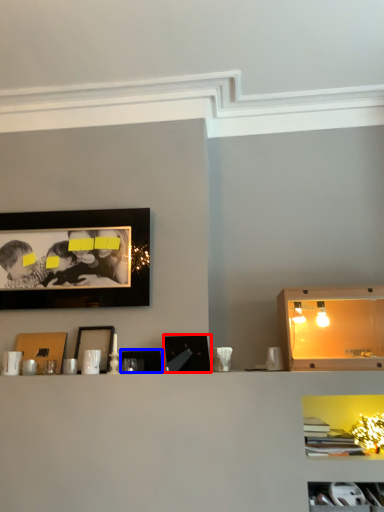
Question: Which object is closer to the camera taking this photo, picture frame (highlighted by a red box) or picture frame (highlighted by a blue box)?

Choices:
 (A) picture frame
 (B) picture frame

Answer: (A)